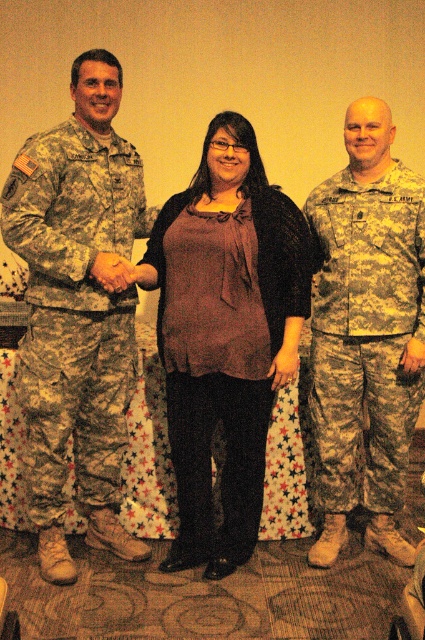
You are a photographer setting up for a group photo. You need to position a microphone stand between the matte brown blouse at center and the camouflage uniform at center so that it doesn t block either. Based on their widths, where should you place the microphone stand?

The matte brown blouse at center might be wider than the camouflage uniform at center, so to avoid blocking either, position the microphone stand slightly closer to the narrower camouflage uniform at center.

You are standing in the room where the three individuals are. You see a point at coordinates [78,308]. Which object does this point belong to?

The point at coordinates [78,308] belongs to the camouflage uniform at left.